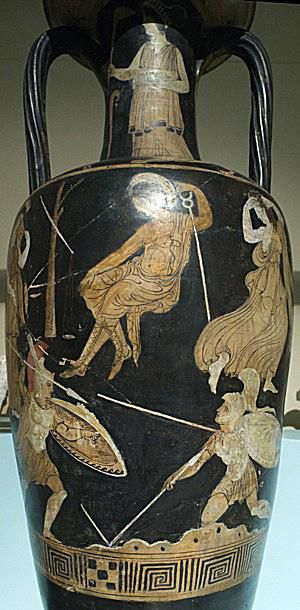
Where is `vase front`? The width and height of the screenshot is (300, 610). vase front is located at coordinates (175, 506), (150, 476), (221, 287), (121, 41).